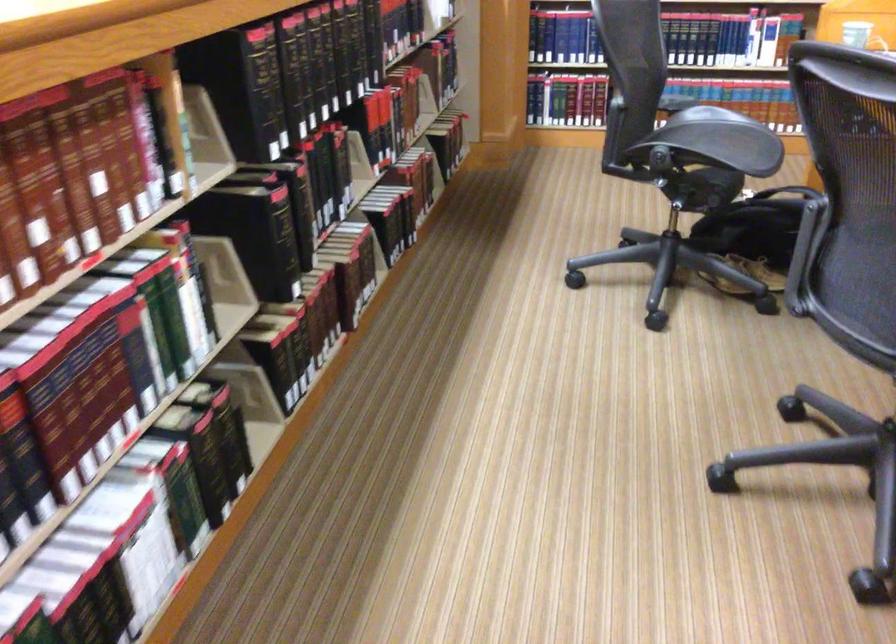
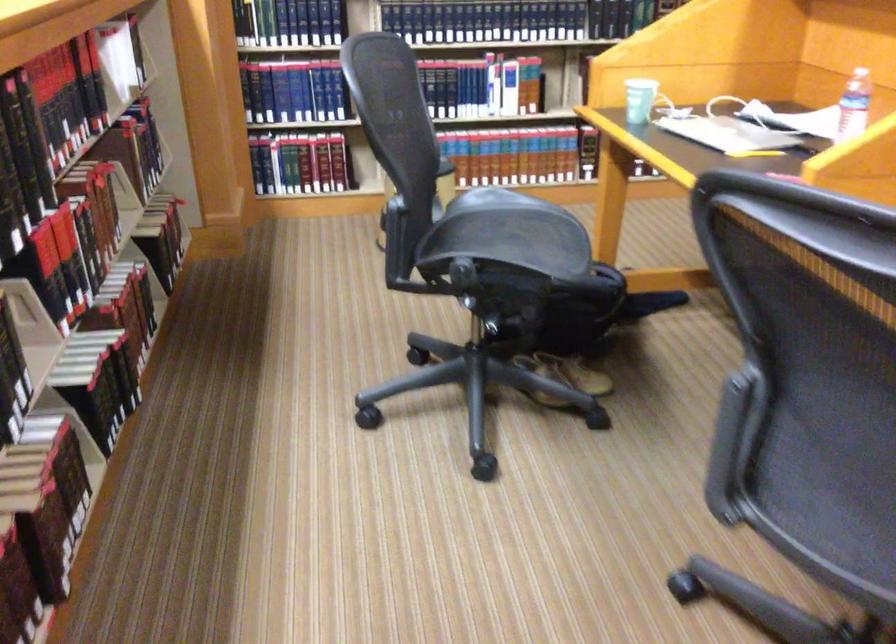
Find the pixel in the second image that matches point (754, 269) in the first image.

(564, 377)